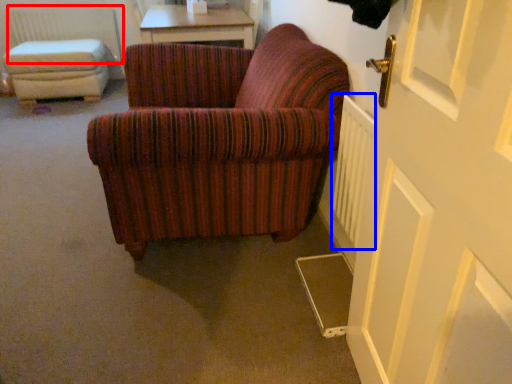
Question: Which object appears farthest to the camera in this image, radiator (highlighted by a red box) or radiator (highlighted by a blue box)?

Choices:
 (A) radiator
 (B) radiator

Answer: (A)